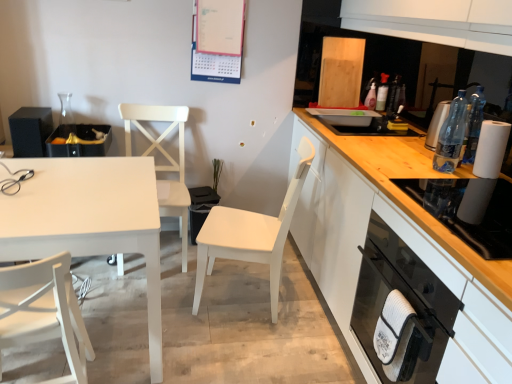
Identify the location of translucent plastic bottle at upper right, the 1th bottle in the top-to-bottom sequence. The height and width of the screenshot is (384, 512). (371, 96).

The height and width of the screenshot is (384, 512). What do you see at coordinates (463, 221) in the screenshot?
I see `clear glass water bottles at right, arranged as the first appliance when viewed from the right` at bounding box center [463, 221].

Describe the element at coordinates (408, 302) in the screenshot. I see `black glass oven at lower right` at that location.

The image size is (512, 384). Identify the location of translucent plastic bottle at upper right, arranged as the second bottle when ordered from the bottom. (371, 96).

Based on the photo, is the surface of clear plastic bottle at right, placed as the first bottle when sorted from bottom to top, in direct contact with natural wood countertop at right?

No, clear plastic bottle at right, placed as the first bottle when sorted from bottom to top, is not next to natural wood countertop at right.

Is clear plastic bottle at right, placed as the first bottle when sorted from bottom to top, turned away from natural wood countertop at right?

clear plastic bottle at right, placed as the first bottle when sorted from bottom to top, is not turned away from natural wood countertop at right.

Is clear plastic bottle at right, the 2th bottle from the back, to the left or to the right of natural wood countertop at right in the image?

clear plastic bottle at right, the 2th bottle from the back, is positioned on natural wood countertop at right's right side.

Does point (455, 144) appear closer or farther from the camera than point (333, 265)?

Point (455, 144) is positioned closer to the camera compared to point (333, 265).

Which object is thinner, white matte chair at lower left, marked as the third chair in a back-to-front arrangement, or white paper at right?

white paper at right.

Would you say white matte chair at lower left, placed as the first chair when sorted from front to back, is inside or outside white paper at right?

white matte chair at lower left, placed as the first chair when sorted from front to back, is outside white paper at right.

Between white matte chair at lower left, marked as the third chair in a back-to-front arrangement, and white paper at right, which one appears on the right side from the viewer's perspective?

white paper at right.

Which is in front, white matte chair at lower left, marked as the third chair in a back-to-front arrangement, or white paper at right?

white matte chair at lower left, marked as the third chair in a back-to-front arrangement.

Is black matte speaker at left, acting as the 1th appliance starting from the back, to the right of white matte chair at center, positioned as the 2th chair in front-to-back order, from the viewer's perspective?

Incorrect, black matte speaker at left, acting as the 1th appliance starting from the back, is not on the right side of white matte chair at center, positioned as the 2th chair in front-to-back order.

Can you confirm if black matte speaker at left, which ranks as the 3th appliance in right-to-left order, is shorter than white matte chair at center, positioned as the 2th chair in front-to-back order?

Yes.

Can you confirm if black matte speaker at left, which ranks as the 1th appliance in left-to-right order, is thinner than white matte chair at center, the second chair positioned from the back?

Yes.

Is black matte speaker at left, which ranks as the 3th appliance in right-to-left order, oriented away from white matte chair at center, positioned as the 2th chair in front-to-back order?

black matte speaker at left, which ranks as the 3th appliance in right-to-left order, is not turned away from white matte chair at center, positioned as the 2th chair in front-to-back order.

From the picture: Relative to clear glass water bottles at right, which ranks as the first appliance in front-to-back order, is white matte chair at center, the second chair positioned from the back, in front or behind?

In the image, white matte chair at center, the second chair positioned from the back, appears behind clear glass water bottles at right, which ranks as the first appliance in front-to-back order.

From a real-world perspective, count 3rd appliances upward from the white matte chair at center, the second chair positioned from the back, and point to it. Please provide its 2D coordinates.

[(463, 221)]

Considering the positions of points (258, 256) and (436, 194), is point (258, 256) closer to camera compared to point (436, 194)?

No, (258, 256) is further to viewer.

How many degrees apart are the facing directions of white matte chair at center, the second chair positioned from the back, and clear glass water bottles at right, marked as the first appliance in a bottom-to-top arrangement?

15.5 degrees separate the facing orientations of white matte chair at center, the second chair positioned from the back, and clear glass water bottles at right, marked as the first appliance in a bottom-to-top arrangement.

From the picture: Is translucent plastic bottle at upper right, arranged as the second bottle when ordered from the bottom, aimed at matte black trash bin at left, the second appliance from the back?

Yes, translucent plastic bottle at upper right, arranged as the second bottle when ordered from the bottom, is facing matte black trash bin at left, the second appliance from the back.

Consider the image. In terms of width, does translucent plastic bottle at upper right, positioned as the first bottle in back-to-front order, look wider or thinner when compared to matte black trash bin at left, acting as the 2th appliance starting from the bottom?

translucent plastic bottle at upper right, positioned as the first bottle in back-to-front order, is thinner than matte black trash bin at left, acting as the 2th appliance starting from the bottom.

Between translucent plastic bottle at upper right, the 1th bottle in the top-to-bottom sequence, and matte black trash bin at left, acting as the 2th appliance starting from the bottom, which one has more height?

Standing taller between the two is translucent plastic bottle at upper right, the 1th bottle in the top-to-bottom sequence.

Is translucent plastic bottle at upper right, the 1th bottle in the top-to-bottom sequence, bigger or smaller than matte black trash bin at left, the 2th appliance viewed from the front?

Clearly, translucent plastic bottle at upper right, the 1th bottle in the top-to-bottom sequence, is smaller in size than matte black trash bin at left, the 2th appliance viewed from the front.

Which is behind, point (205, 37) or point (101, 232)?

The point (205, 37) is behind.

Is matte paperboard calendar at upper center next to white matte table at left and touching it?

No, matte paperboard calendar at upper center is not beside white matte table at left.

Is matte paperboard calendar at upper center facing towards white matte table at left?

No, matte paperboard calendar at upper center is not oriented towards white matte table at left.

Is white matte chair at center, the second chair positioned from the back, at the back of matte black trash bin at left, the 2th appliance in the right-to-left sequence?

That's not correct — matte black trash bin at left, the 2th appliance in the right-to-left sequence, is not looking away from white matte chair at center, the second chair positioned from the back.

Choose the correct answer: Is matte black trash bin at left, the 2th appliance in the right-to-left sequence, inside white matte chair at center, the second chair positioned from the back, or outside it?

matte black trash bin at left, the 2th appliance in the right-to-left sequence, is not inside white matte chair at center, the second chair positioned from the back, it's outside.

Does point (106, 135) appear closer or farther from the camera than point (298, 181)?

Point (106, 135) is positioned closer to the camera compared to point (298, 181).

From a real-world perspective, who is located higher, matte black trash bin at left, the second appliance viewed from the top, or white matte chair at center, positioned as the 2th chair in front-to-back order?

From a 3D spatial view, matte black trash bin at left, the second appliance viewed from the top, is above.

Image resolution: width=512 pixels, height=384 pixels. I want to click on bottle that is the 1st object located behind the natural wood countertop at right, so click(x=451, y=136).

From the image's perspective, starting from the white paper at right, which chair is the 3rd one below? Please provide its 2D coordinates.

[(44, 312)]

Considering their positions, is translucent plastic bottle at upper right, arranged as the second bottle when ordered from the bottom, positioned further to black matte speaker at left, placed as the third appliance when sorted from front to back, than white matte chair at lower left, placed as the first chair when sorted from front to back?

Based on the image, translucent plastic bottle at upper right, arranged as the second bottle when ordered from the bottom, appears to be further to black matte speaker at left, placed as the third appliance when sorted from front to back.

Based on the photo, which object lies further to the anchor point black glass oven at lower right, white paper at right or matte black trash bin at left, the 2th appliance viewed from the front?

matte black trash bin at left, the 2th appliance viewed from the front, is positioned further to the anchor black glass oven at lower right.

From the image, which object appears to be farther from clear plastic bottle at right, positioned as the 1th bottle in front-to-back order, white paper at right or matte black trash bin at left, the 2th appliance in the right-to-left sequence?

matte black trash bin at left, the 2th appliance in the right-to-left sequence.

From the image, which object appears to be nearer to white matte table at left, clear glass water bottles at right, which is the third appliance from left to right, or white paper at right?

clear glass water bottles at right, which is the third appliance from left to right, is closer to white matte table at left.

From the image, which object appears to be farther from white matte chair at center, the 1th chair positioned from the back, translucent plastic bottle at upper right, positioned as the first bottle in back-to-front order, or matte paperboard calendar at upper center?

translucent plastic bottle at upper right, positioned as the first bottle in back-to-front order, is further to white matte chair at center, the 1th chair positioned from the back.

Estimate the real-world distances between objects in this image. Which object is further from white matte chair at lower left, marked as the third chair in a back-to-front arrangement, natural wood countertop at right or translucent plastic bottle at upper right, positioned as the first bottle in back-to-front order?

translucent plastic bottle at upper right, positioned as the first bottle in back-to-front order, is further to white matte chair at lower left, marked as the third chair in a back-to-front arrangement.

Considering their positions, is black matte speaker at left, marked as the third appliance in a bottom-to-top arrangement, positioned further to white matte chair at lower left, marked as the third chair in a back-to-front arrangement, than translucent plastic bottle at upper right, the 1th bottle in the top-to-bottom sequence?

Based on the image, translucent plastic bottle at upper right, the 1th bottle in the top-to-bottom sequence, appears to be further to white matte chair at lower left, marked as the third chair in a back-to-front arrangement.

Considering their positions, is white matte chair at center, which ranks as the 3th chair in front-to-back order, positioned closer to translucent plastic bottle at upper right, positioned as the first bottle in back-to-front order, than matte paperboard calendar at upper center?

matte paperboard calendar at upper center lies closer to translucent plastic bottle at upper right, positioned as the first bottle in back-to-front order, than the other object.

Find the location of `bulletin board between matte black trash bin at left, the 2th appliance in the right-to-left sequence, and clear glass water bottles at right, marked as the first appliance in a bottom-to-top arrangement, in the horizontal direction`. bulletin board between matte black trash bin at left, the 2th appliance in the right-to-left sequence, and clear glass water bottles at right, marked as the first appliance in a bottom-to-top arrangement, in the horizontal direction is located at coordinates (218, 40).

At what (x,y) coordinates should I click in order to perform the action: click on appliance between white matte chair at center, the second chair positioned from the back, and white paper at right, in the horizontal direction. Please return your answer as a coordinate pair (x, y). The height and width of the screenshot is (384, 512). Looking at the image, I should click on click(x=463, y=221).

This screenshot has width=512, height=384. I want to click on kitchen appliance located between white matte chair at center, positioned as the 2th chair in front-to-back order, and clear plastic bottle at right, positioned as the 1th bottle in front-to-back order, in the left-right direction, so click(408, 302).

In order to click on bulletin board between matte black trash bin at left, the 2th appliance in the right-to-left sequence, and clear plastic bottle at right, placed as the first bottle when sorted from bottom to top, from left to right in this screenshot , I will do `click(218, 40)`.